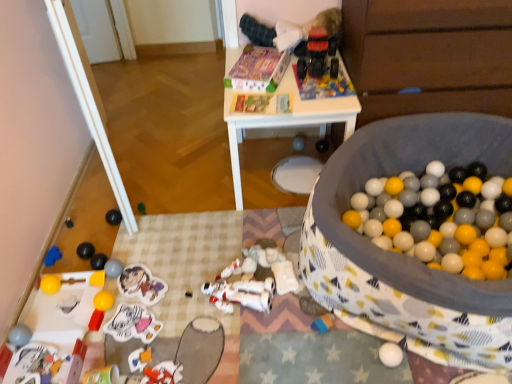
Locate an element on the screen. This screenshot has height=384, width=512. vacant area on top of matte cardboard box at upper center, arranged as the sixteenth toy when viewed from the left (from a real-world perspective) is located at coordinates (264, 58).